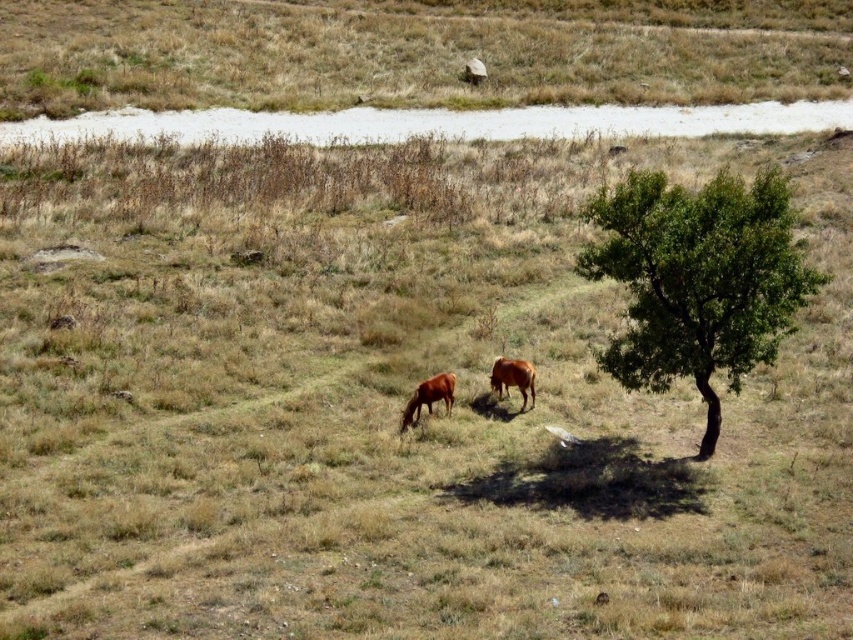
Question: Which point appears farthest from the camera in this image?

Choices:
 (A) (502, 392)
 (B) (769, 276)

Answer: (A)

Question: Does green leafy tree at right have a greater width compared to brown matte cow at center?

Choices:
 (A) yes
 (B) no

Answer: (B)

Question: Which object is farther from the camera taking this photo?

Choices:
 (A) brown glossy cow at center
 (B) brown matte cow at center
 (C) green leafy tree at right

Answer: (A)

Question: Does brown matte cow at center appear over brown glossy cow at center?

Choices:
 (A) yes
 (B) no

Answer: (B)

Question: Estimate the real-world distances between objects in this image. Which object is farther from the green leafy tree at right?

Choices:
 (A) brown matte cow at center
 (B) brown glossy cow at center

Answer: (A)

Question: Does green leafy tree at right appear on the left side of brown matte cow at center?

Choices:
 (A) no
 (B) yes

Answer: (A)